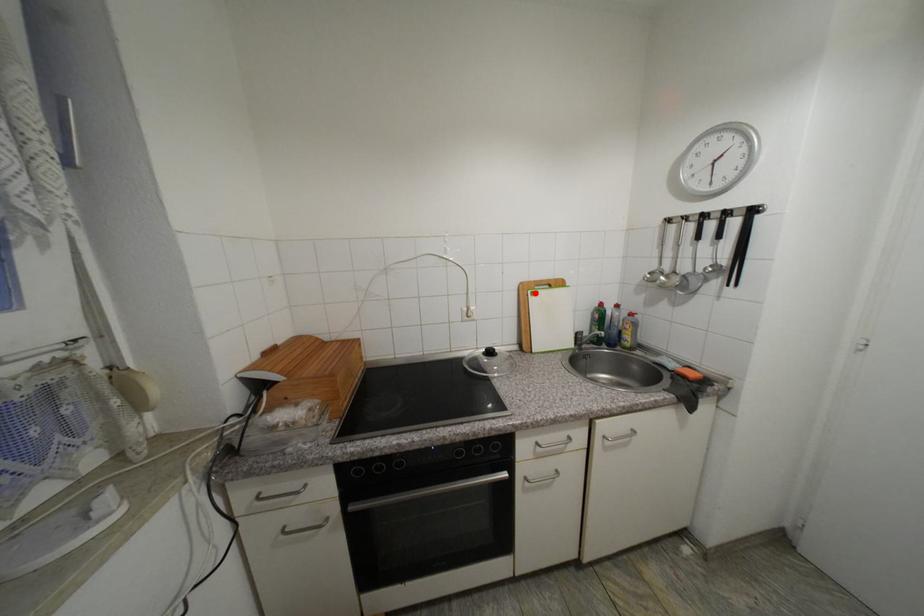
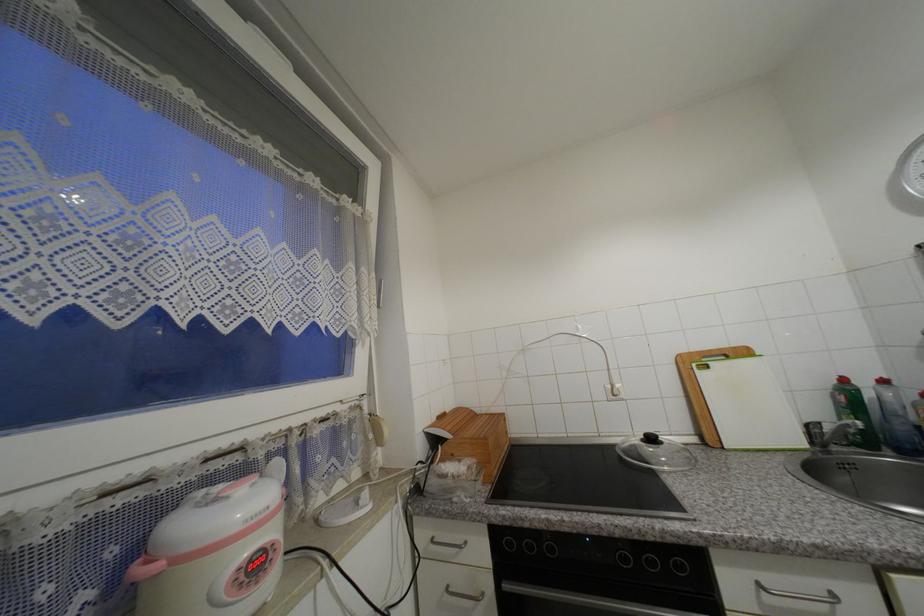
In the second image, find the point that corresponds to the highlighted location in the first image.

(699, 367)